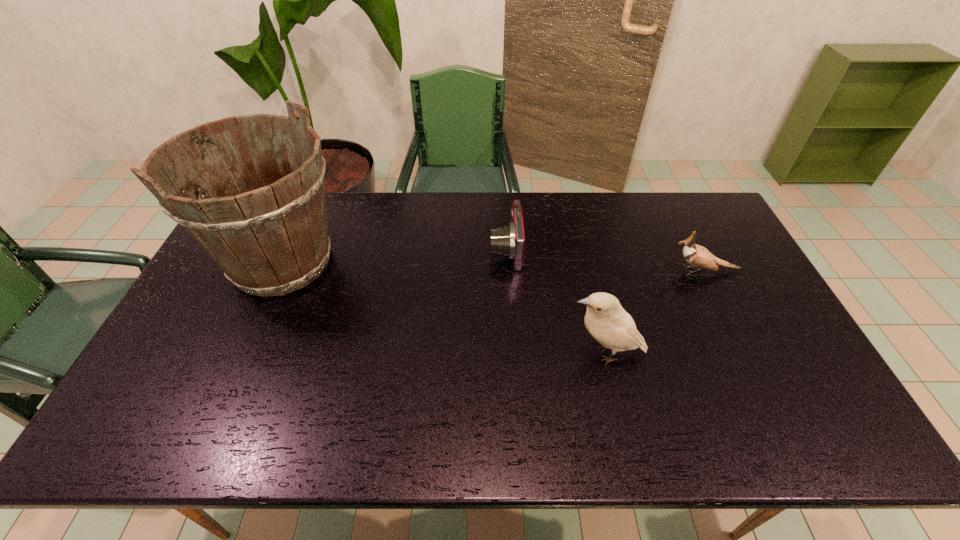
Locate an element on the screen. The width and height of the screenshot is (960, 540). object located at the left edge is located at coordinates (270, 238).

Where is `object positioned at the right edge`? object positioned at the right edge is located at coordinates (696, 255).

Locate an element on the screen. The height and width of the screenshot is (540, 960). object that is at the far left corner is located at coordinates (270, 238).

Find the location of a particular element. vacant area at the far edge of the desktop is located at coordinates (379, 198).

Where is `free spot at the near edge of the desktop`? free spot at the near edge of the desktop is located at coordinates (701, 422).

Locate an element on the screen. vacant space at the left edge is located at coordinates (220, 285).

Identify the location of vacant region at the right edge of the desktop. This screenshot has height=540, width=960. pos(822,391).

Locate an element on the screen. The image size is (960, 540). free spot between the shortest object and the tallest object is located at coordinates (394, 256).

I want to click on blank region between the camera and the third shortest object, so [x=555, y=302].

Locate an element on the screen. blank region between the leftmost object and the third tallest object is located at coordinates (492, 266).